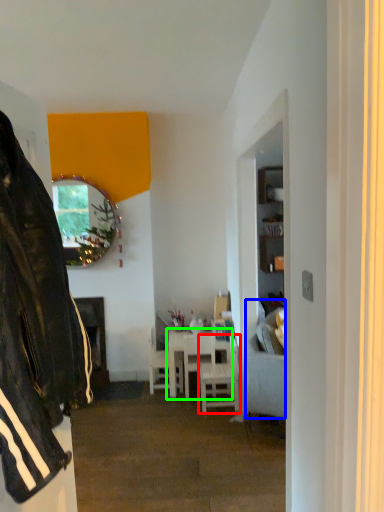
Question: Which object is the farthest from chair (highlighted by a red box)? Choose among these: studio couch (highlighted by a blue box) or table (highlighted by a green box).

Choices:
 (A) studio couch
 (B) table

Answer: (A)